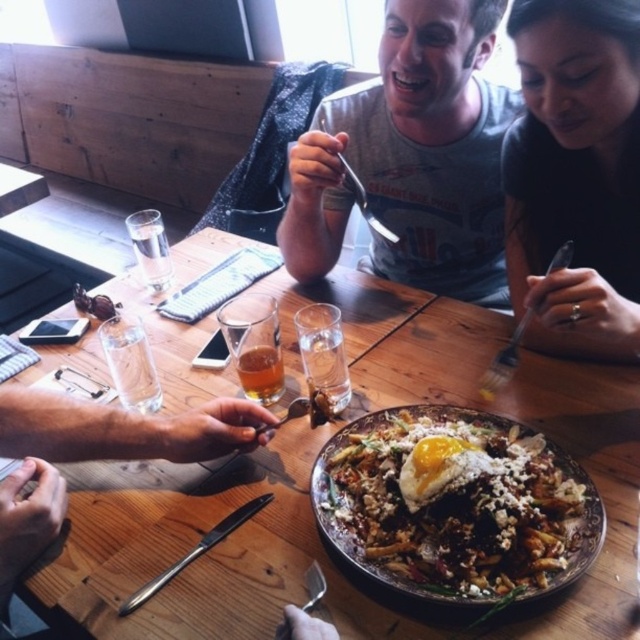
You are a waiter at the restaurant and need to place a new order of a salad on the table. The table has limited space. The existing items include a translucent glass beer at center. Where should you place the salad to avoid blocking the beer? Please provide coordinates in the format of a point like point (260, 372).

The salad should be placed at point (260, 372) to avoid blocking the translucent glass beer at center, but since that point is already occupied by the beer, choose another location such as point 0.3, 0.6.

You are a waiter holding a tray of dishes. You need to place a new dessert plate on the table without moving any existing items. The dessert plate is 12 inches in diameter. Is there enough space between the translucent glass beer at center and the edge of the table to fit the dessert plate?

The distance between the translucent glass beer at center and the camera is 32.25 inches. However, the distance between the beer and the edge of the table is not provided. Therefore, it is impossible to determine if the dessert plate will fit without additional information.

You are a waiter at the restaurant and need to place a small bowl between the two points on the table. The first point is at coordinate point (422,12) and the second point is at coordinate point (492,444). Which point is closer to you so you can place the bowl in front of that customer?

Point (422,12) is closer to you than point (492,444), so you should place the bowl in front of the customer at point (422,12).